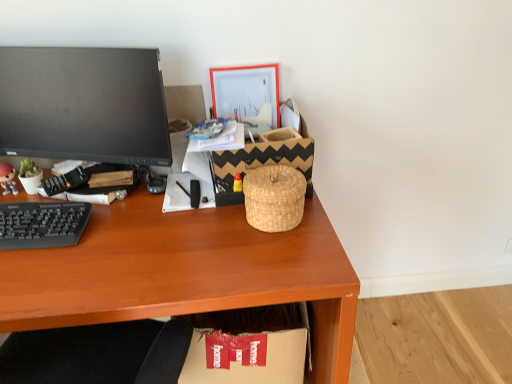
Question: In the image, is black plastic keyboard at left positioned in front of or behind matte plastic picture frame at upper center?

Choices:
 (A) front
 (B) behind

Answer: (A)

Question: From a real-world perspective, relative to matte plastic picture frame at upper center, is black plastic keyboard at left vertically above or below?

Choices:
 (A) above
 (B) below

Answer: (B)

Question: Considering the real-world distances, which object is farthest from the black plastic keyboard at left?

Choices:
 (A) matte plastic figurine at left
 (B) woven natural basket at center
 (C) black matte computer monitor at left
 (D) matte plastic picture frame at upper center
 (E) cardboard box at lower center

Answer: (E)

Question: Considering the real-world distances, which object is farthest from the wooden desk at center?

Choices:
 (A) black plastic keyboard at left
 (B) woven natural basket at center
 (C) black matte computer monitor at left
 (D) cardboard box at lower center
 (E) matte plastic figurine at left

Answer: (E)